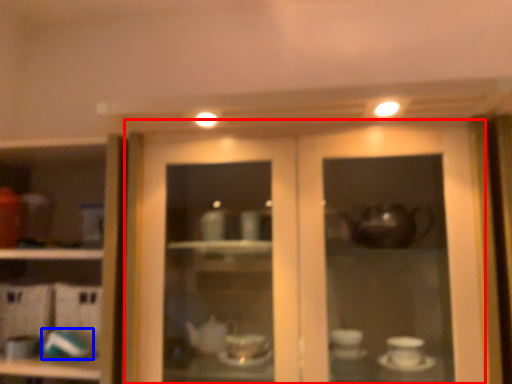
Question: Which of the following is the farthest to the observer, door (highlighted by a red box) or tableware (highlighted by a blue box)?

Choices:
 (A) door
 (B) tableware

Answer: (B)